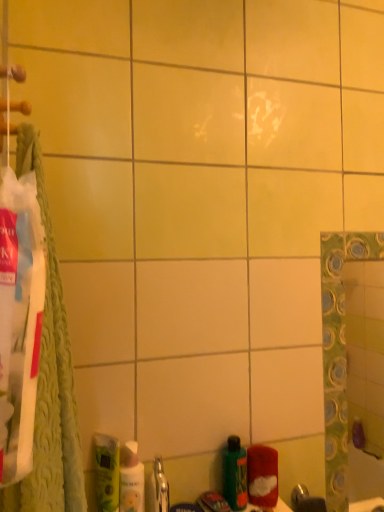
Question: Which is correct: green matte mouthwash at lower left, which is the first mouthwash from left to right, is inside red fuzzy cloth at lower right, or outside of it?

Choices:
 (A) inside
 (B) outside

Answer: (B)

Question: Is point (104, 449) closer or farther from the camera than point (276, 455)?

Choices:
 (A) farther
 (B) closer

Answer: (B)

Question: Estimate the real-world distances between objects in this image. Which object is farther from the red fuzzy cloth at lower right?

Choices:
 (A) green matte toothpaste at lower center
 (B) green textured towel at left
 (C) green matte bottle at lower center
 (D) green matte mouthwash at lower left, the 2th mouthwash positioned from the right
 (E) white glossy mouthwash at lower left, which is the second mouthwash from left to right

Answer: (B)

Question: Which object is positioned closest to the green matte bottle at lower center?

Choices:
 (A) green matte mouthwash at lower left, the 2th mouthwash positioned from the right
 (B) green matte toothpaste at lower center
 (C) white glossy mouthwash at lower left, which ranks as the first mouthwash in right-to-left order
 (D) red fuzzy cloth at lower right
 (E) green textured towel at left

Answer: (D)